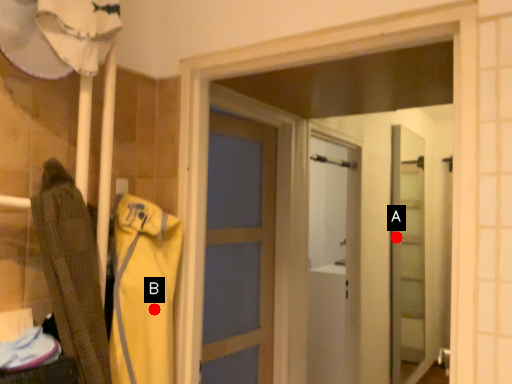
Question: Two points are circled on the image, labeled by A and B beside each circle. Which point is further to the camera?

Choices:
 (A) A is further
 (B) B is further

Answer: (A)